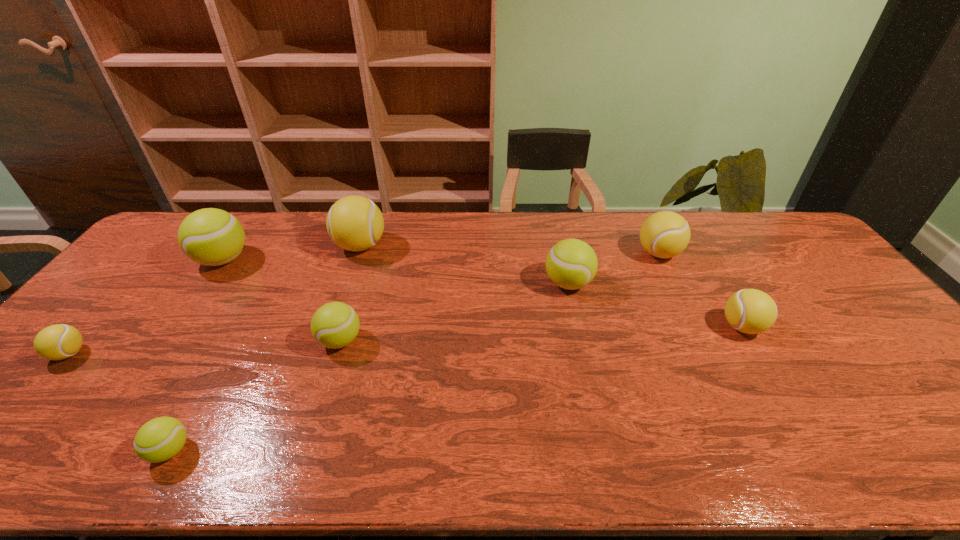
Where is `the leftmost object`? This screenshot has height=540, width=960. the leftmost object is located at coordinates (60, 341).

At what (x,y) coordinates should I click in order to perform the action: click on the third tennis ball from left to right. Please return your answer as a coordinate pair (x, y). This screenshot has height=540, width=960. Looking at the image, I should click on (160, 439).

Locate an element on the screen. This screenshot has height=540, width=960. the smallest green tennis ball is located at coordinates (160, 439).

At what (x,y) coordinates should I click in order to perform the action: click on vacant space situated on the front of the second tennis ball from left to right. Please return your answer as a coordinate pair (x, y). The image size is (960, 540). Looking at the image, I should click on (182, 318).

Locate an element on the screen. The image size is (960, 540). blank space located 0.170m on the left of the second yellow tennis ball from left to right is located at coordinates (283, 246).

Locate an element on the screen. vacant space located 0.130m on the left of the second biggest yellow tennis ball is located at coordinates (596, 253).

Locate an element on the screen. This screenshot has width=960, height=540. vacant space situated on the right of the sixth tennis ball from left to right is located at coordinates (665, 284).

Identify the location of free space located 0.200m on the left of the third farthest green tennis ball. (242, 341).

Locate an element on the screen. vacant space situated on the right of the third biggest yellow tennis ball is located at coordinates (833, 327).

What are the coordinates of `vacant space located 0.150m on the back of the leftmost yellow tennis ball` in the screenshot? It's located at (116, 301).